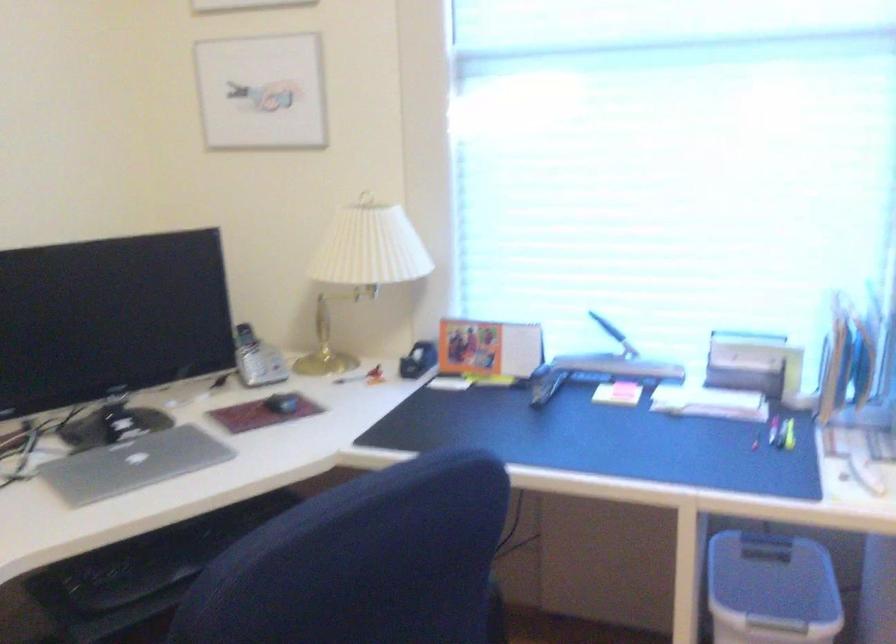
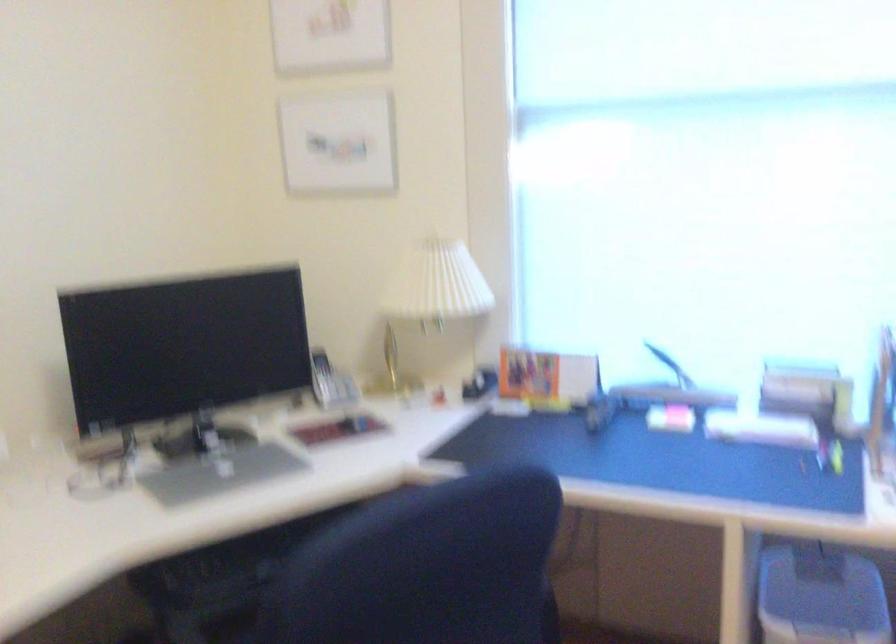
Locate, in the second image, the point that corresponds to [366,263] in the first image.

(433, 295)